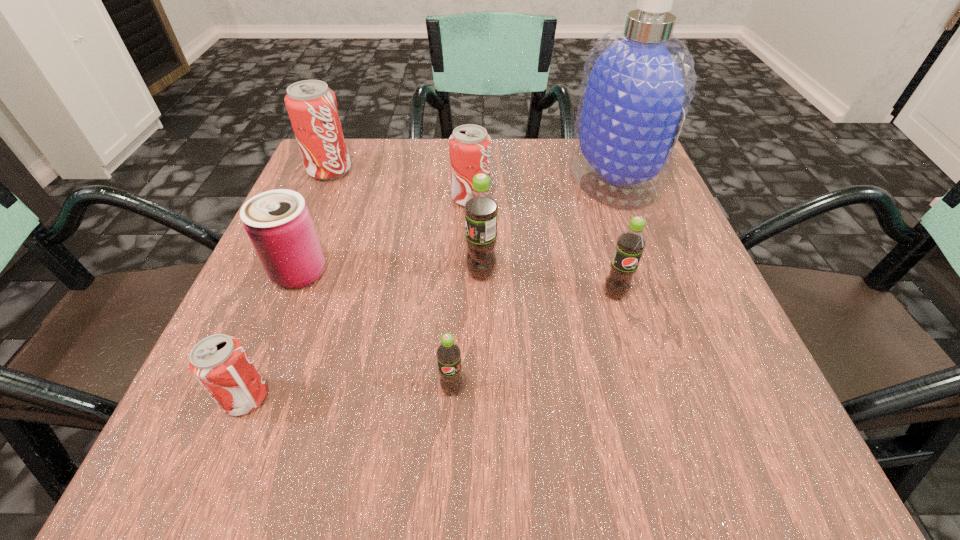
You are a GUI agent. You are given a task and a screenshot of the screen. Output one action in this format:
    pyautogui.click(x=<x>, y=<y>)
    Task: Click on the nearest green soda
    
    Given the screenshot: What is the action you would take?
    pyautogui.click(x=448, y=353)

The width and height of the screenshot is (960, 540). I want to click on vacant space located on the left of the cleansing agent, so click(x=422, y=179).

Locate an element on the screen. Image resolution: width=960 pixels, height=540 pixels. free location located 0.270m on the front of the farthest soda is located at coordinates (286, 272).

Where is `vacant area located on the front label of the biggest green soda`? The image size is (960, 540). vacant area located on the front label of the biggest green soda is located at coordinates (268, 273).

Identify the location of free space located 0.160m on the front label of the biggest green soda. (372, 273).

This screenshot has width=960, height=540. What are the coordinates of `free space located on the front label of the biggest green soda` in the screenshot? It's located at (413, 273).

Identify the location of vacant space located 0.250m on the left of the second smallest pink soda can. The width and height of the screenshot is (960, 540). (330, 199).

Locate an element on the screen. The height and width of the screenshot is (540, 960). vacant area situated 0.120m on the front label of the rightmost green soda is located at coordinates coord(636,368).

Locate an element on the screen. vacant space located on the back of the pink can is located at coordinates (333, 186).

At what (x,y) coordinates should I click in order to perform the action: click on blank space located on the back of the nearest pink soda can. Please return your answer as a coordinate pair (x, y). Looking at the image, I should click on (286, 298).